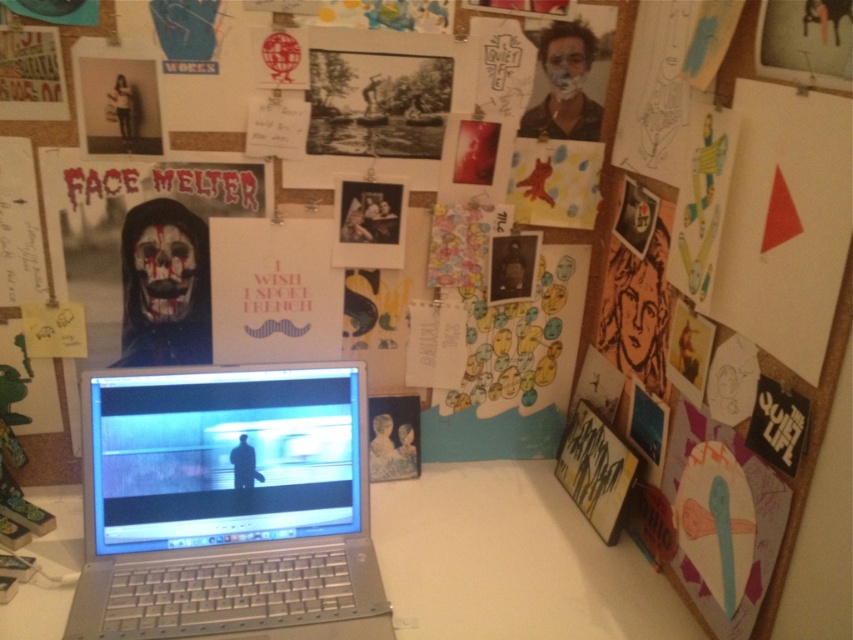
Who is shorter, silver metallic laptop at center or white plastic table at center?

white plastic table at center

Measure the distance between point (212, 497) and camera.

1.04 meters

Who is more distant from viewer, (x=248, y=452) or (x=511, y=486)?

Positioned behind is point (x=511, y=486).

Where is `silver metallic laptop at center`? The height and width of the screenshot is (640, 853). silver metallic laptop at center is located at coordinates (227, 506).